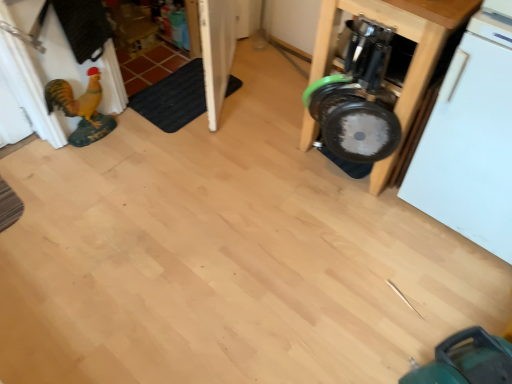
This screenshot has height=384, width=512. Find the location of `vacant area located to the right-hand side of black rubber mat at lower left`. vacant area located to the right-hand side of black rubber mat at lower left is located at coordinates (261, 101).